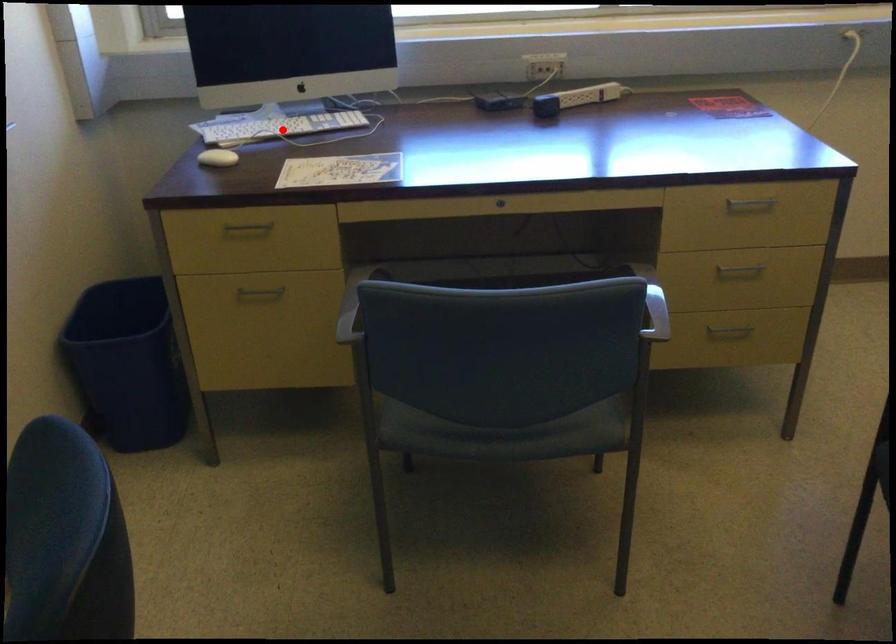
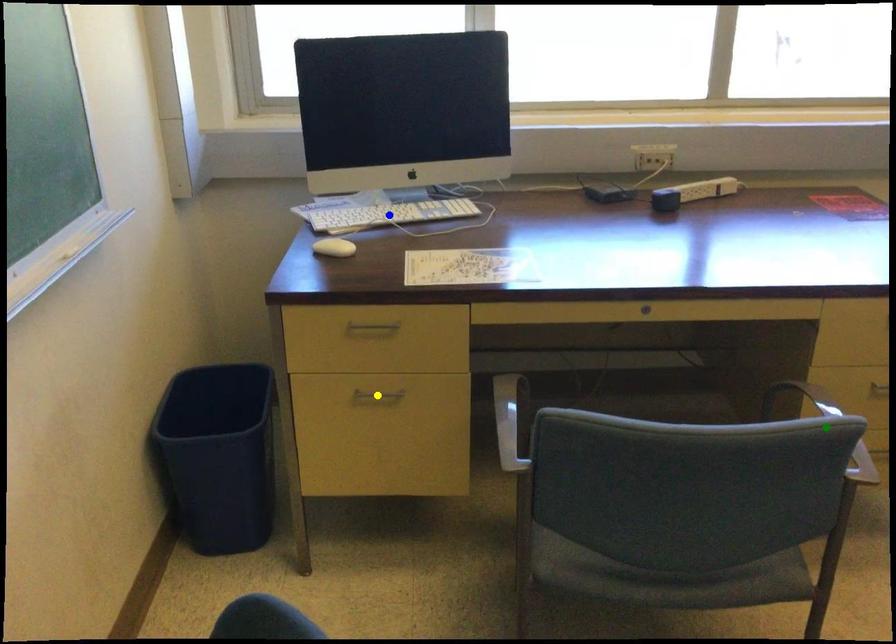
Question: I am providing you with two images of the same scene from different viewpoints. A red point is marked on the first image. You are given multiple points on the second image. Which spot in image 2 lines up with the point in image 1?

Choices:
 (A) green point
 (B) yellow point
 (C) blue point

Answer: (C)